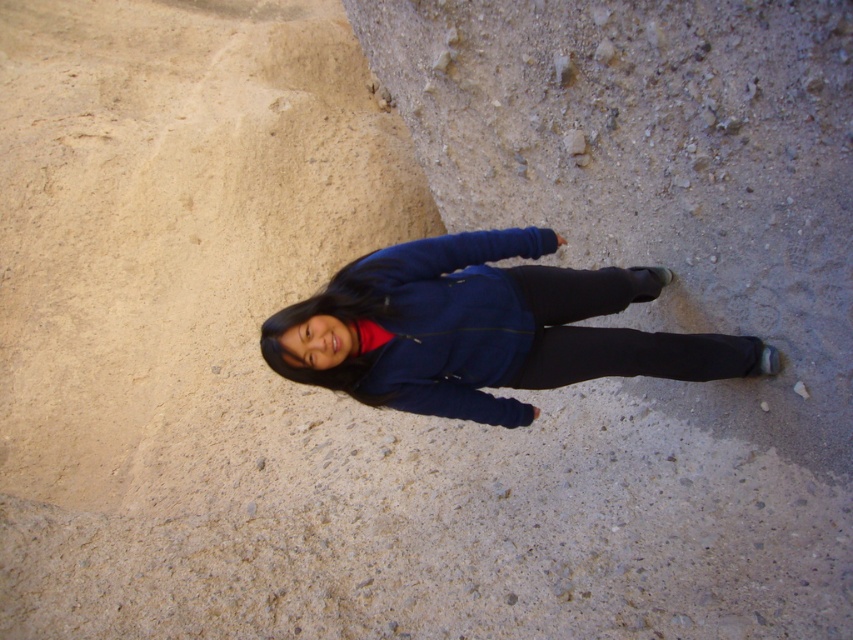
Is blue fabric jacket at center to the left of matte blue sweatshirt at center from the viewer's perspective?

No, blue fabric jacket at center is not to the left of matte blue sweatshirt at center.

Does blue fabric jacket at center have a larger size compared to matte blue sweatshirt at center?

Yes, blue fabric jacket at center is bigger than matte blue sweatshirt at center.

You are a GUI agent. You are given a task and a screenshot of the screen. Output one action in this format:
    pyautogui.click(x=<x>, y=<y>)
    Task: Click on the blue fabric jacket at center
    The height and width of the screenshot is (640, 853).
    Given the screenshot: What is the action you would take?
    pyautogui.click(x=485, y=328)